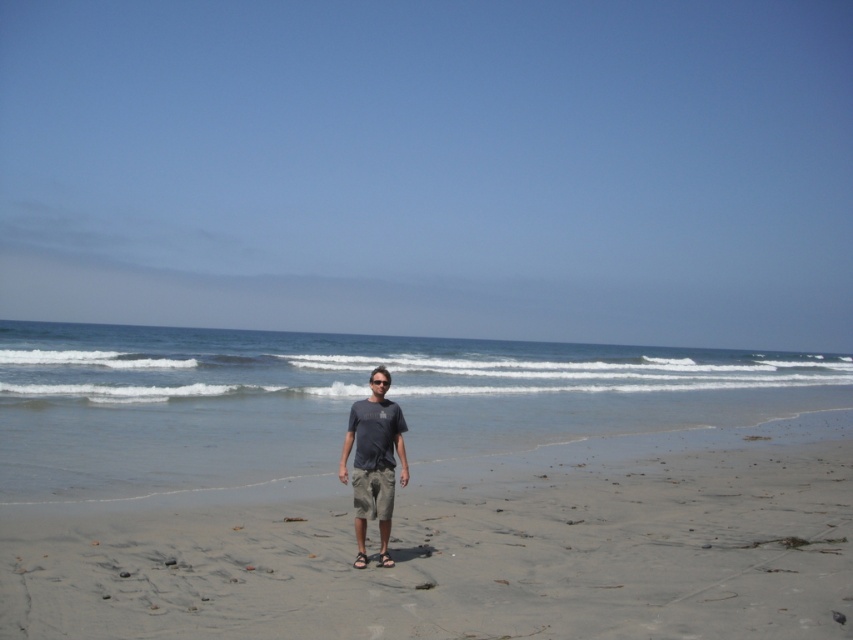
In the scene shown: Between gray sand at center and dark gray t-shirt at center, which one appears on the left side from the viewer's perspective?

dark gray t-shirt at center

Is gray sand at center shorter than dark gray t-shirt at center?

Yes, gray sand at center is shorter than dark gray t-shirt at center.

Which is behind, point (114, 636) or point (376, 422)?

Point (376, 422)

Where is `gray sand at center`? gray sand at center is located at coordinates (469, 547).

Between dark gray t-shirt at center and black rubber sandal at center, which one appears on the right side from the viewer's perspective?

From the viewer's perspective, black rubber sandal at center appears more on the right side.

Is dark gray t-shirt at center below black rubber sandal at center?

Incorrect, dark gray t-shirt at center is not positioned below black rubber sandal at center.

Find the location of a particular element. dark gray t-shirt at center is located at coordinates click(374, 456).

This screenshot has height=640, width=853. Identify the location of dark gray t-shirt at center. (374, 456).

Between black rubber sandal at center and brown leather sandal at center, which one is positioned lower?

brown leather sandal at center

Who is shorter, black rubber sandal at center or brown leather sandal at center?

Standing shorter between the two is black rubber sandal at center.

Which is in front, point (387, 563) or point (358, 566)?

Positioned in front is point (358, 566).

Identify the location of black rubber sandal at center. (384, 560).